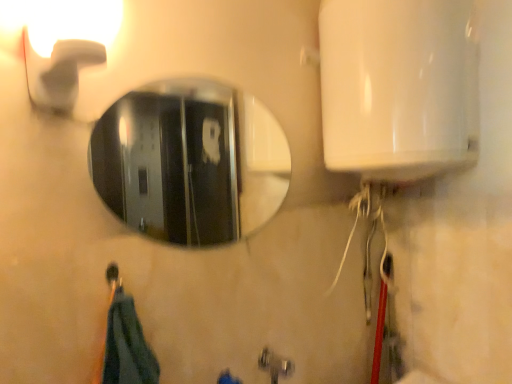
Question: Is metallic silver faucet at lower center far from matte white faucet at upper left?

Choices:
 (A) no
 (B) yes

Answer: (A)

Question: From the image's perspective, would you say metallic silver faucet at lower center is positioned over matte white faucet at upper left?

Choices:
 (A) no
 (B) yes

Answer: (A)

Question: Can you confirm if metallic silver faucet at lower center is taller than matte white faucet at upper left?

Choices:
 (A) yes
 (B) no

Answer: (B)

Question: Considering the relative positions of metallic silver faucet at lower center and matte white faucet at upper left in the image provided, is metallic silver faucet at lower center to the right of matte white faucet at upper left from the viewer's perspective?

Choices:
 (A) yes
 (B) no

Answer: (A)

Question: Is metallic silver faucet at lower center shorter than matte white faucet at upper left?

Choices:
 (A) no
 (B) yes

Answer: (B)

Question: Can you see metallic silver faucet at lower center touching matte white faucet at upper left?

Choices:
 (A) no
 (B) yes

Answer: (A)

Question: Does matte white faucet at upper left lie in front of shiny metallic mirror at center?

Choices:
 (A) no
 (B) yes

Answer: (B)

Question: Can you confirm if matte white faucet at upper left is positioned to the right of shiny metallic mirror at center?

Choices:
 (A) yes
 (B) no

Answer: (B)

Question: Is matte white faucet at upper left outside shiny metallic mirror at center?

Choices:
 (A) no
 (B) yes

Answer: (B)

Question: Is matte white faucet at upper left smaller than shiny metallic mirror at center?

Choices:
 (A) no
 (B) yes

Answer: (A)

Question: Considering the relative sizes of matte white faucet at upper left and shiny metallic mirror at center in the image provided, is matte white faucet at upper left wider than shiny metallic mirror at center?

Choices:
 (A) yes
 (B) no

Answer: (A)

Question: Does matte white faucet at upper left have a larger size compared to shiny metallic mirror at center?

Choices:
 (A) yes
 (B) no

Answer: (A)

Question: Does shiny metallic mirror at center lie behind matte white faucet at upper left?

Choices:
 (A) yes
 (B) no

Answer: (A)